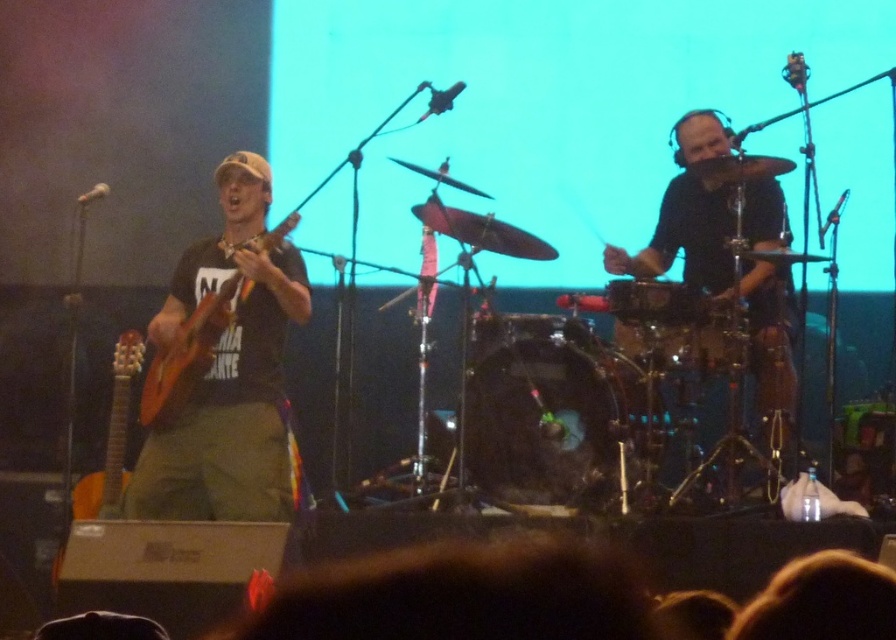
Question: In this image, where is shiny black drum at center located relative to acoustic wood guitar at left?

Choices:
 (A) right
 (B) left

Answer: (A)

Question: Which object is closer to the camera taking this photo?

Choices:
 (A) acoustic wood guitar at left
 (B) orange wood guitar at left
 (C) shiny black drum at center
 (D) black matte drum set at right

Answer: (A)

Question: Does orange wood guitar at left lie behind shiny black drum at center?

Choices:
 (A) yes
 (B) no

Answer: (B)

Question: Does shiny black drum at center lie behind acoustic wood guitar at left?

Choices:
 (A) no
 (B) yes

Answer: (B)

Question: Which object appears farthest from the camera in this image?

Choices:
 (A) black drum at center
 (B) acoustic wood guitar at left
 (C) matte black guitar at left
 (D) orange wood guitar at left

Answer: (A)

Question: Among these objects, which one is nearest to the camera?

Choices:
 (A) shiny black drum at center
 (B) matte black guitar at left
 (C) black matte drum set at right

Answer: (B)